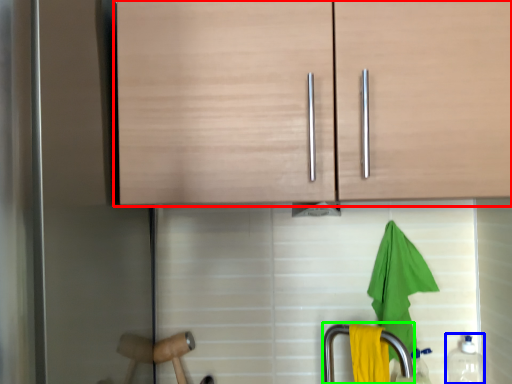
Question: Based on their relative distances, which object is nearer to cabinetry (highlighted by a red box)? Choose from bottle (highlighted by a blue box) and faucet (highlighted by a green box).

Choices:
 (A) bottle
 (B) faucet

Answer: (B)